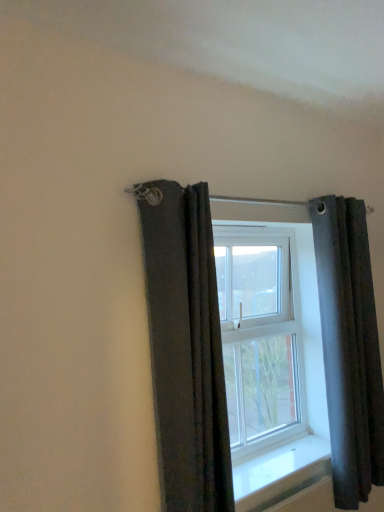
You are a GUI agent. You are given a task and a screenshot of the screen. Output one action in this format:
    pyautogui.click(x=<x>, y=<y>)
    Task: Click on the white glossy window sill at center
    
    Given the screenshot: What is the action you would take?
    pyautogui.click(x=281, y=473)

This screenshot has height=512, width=384. What do you see at coordinates (281, 473) in the screenshot? I see `white glossy window sill at center` at bounding box center [281, 473].

Where is `dark gray fabric curtain at right, positioned as the second curtain in front-to-back order`? Image resolution: width=384 pixels, height=512 pixels. dark gray fabric curtain at right, positioned as the second curtain in front-to-back order is located at coordinates (349, 347).

The height and width of the screenshot is (512, 384). What do you see at coordinates (186, 347) in the screenshot?
I see `dark gray fabric curtain at upper left, the 1th curtain when ordered from left to right` at bounding box center [186, 347].

Locate an element on the screen. white glossy window sill at center is located at coordinates pos(281,473).

In order to click on window sill beneath the dark gray fabric curtain at upper left, acting as the first curtain starting from the front (from a real-world perspective) in this screenshot , I will do `click(281, 473)`.

Which is further, (305, 485) or (140, 185)?

Point (305, 485)

How much distance is there between white glossy window sill at center and dark gray fabric curtain at upper left, the 2th curtain positioned from the back?

white glossy window sill at center is 23.66 inches from dark gray fabric curtain at upper left, the 2th curtain positioned from the back.

From the picture: Is dark gray fabric curtain at upper left, the 1th curtain when ordered from left to right, completely or partially inside white glossy window sill at center?

No, dark gray fabric curtain at upper left, the 1th curtain when ordered from left to right, is not a part of white glossy window sill at center.

Is dark gray fabric curtain at right, the 1th curtain positioned from the right, far away from clear glass window at center?

No.

From the image's perspective, between dark gray fabric curtain at right, the 1th curtain positioned from the right, and clear glass window at center, which one is located above?

clear glass window at center appears higher in the image.

Consider the image. Does dark gray fabric curtain at right, positioned as the second curtain in front-to-back order, have a smaller size compared to clear glass window at center?

No, dark gray fabric curtain at right, positioned as the second curtain in front-to-back order, is not smaller than clear glass window at center.

Identify the location of window sill lying below the dark gray fabric curtain at upper left, arranged as the second curtain when viewed from the right (from the image's perspective). This screenshot has height=512, width=384. (281, 473).

Considering the sizes of objects dark gray fabric curtain at upper left, arranged as the second curtain when viewed from the right, and white glossy window sill at center in the image provided, who is bigger, dark gray fabric curtain at upper left, arranged as the second curtain when viewed from the right, or white glossy window sill at center?

Bigger between the two is dark gray fabric curtain at upper left, arranged as the second curtain when viewed from the right.

Is dark gray fabric curtain at upper left, the 2th curtain positioned from the back, further to camera compared to white glossy window sill at center?

No, it is in front of white glossy window sill at center.

How many degrees apart are the facing directions of dark gray fabric curtain at upper left, the 2th curtain positioned from the back, and white glossy window sill at center?

The angle between the facing direction of dark gray fabric curtain at upper left, the 2th curtain positioned from the back, and the facing direction of white glossy window sill at center is 0.00121 degrees.

Is white glossy window sill at center looking in the opposite direction of dark gray fabric curtain at right, marked as the first curtain in a back-to-front arrangement?

No.

From the image's perspective, which object appears higher, white glossy window sill at center or dark gray fabric curtain at right, which is the 2th curtain in left-to-right order?

dark gray fabric curtain at right, which is the 2th curtain in left-to-right order, is shown above in the image.

From a real-world perspective, is white glossy window sill at center positioned under dark gray fabric curtain at right, the 1th curtain positioned from the right, based on gravity?

Yes, from a real-world perspective, white glossy window sill at center is below dark gray fabric curtain at right, the 1th curtain positioned from the right.

Is white glossy window sill at center to the left or to the right of dark gray fabric curtain at right, the 1th curtain positioned from the right, in the image?

Based on their positions, white glossy window sill at center is located to the left of dark gray fabric curtain at right, the 1th curtain positioned from the right.

Which of these two, clear glass window at center or white glossy window sill at center, is smaller?

white glossy window sill at center.

From a real-world perspective, is clear glass window at center over white glossy window sill at center?

Correct, in the physical world, clear glass window at center is higher than white glossy window sill at center.

Based on the photo, considering the sizes of objects clear glass window at center and white glossy window sill at center in the image provided, who is shorter, clear glass window at center or white glossy window sill at center?

Standing shorter between the two is white glossy window sill at center.

Could you tell me if dark gray fabric curtain at upper left, arranged as the second curtain when viewed from the right, is turned towards dark gray fabric curtain at right, which is the 2th curtain in left-to-right order?

No, dark gray fabric curtain at upper left, arranged as the second curtain when viewed from the right, does not turn towards dark gray fabric curtain at right, which is the 2th curtain in left-to-right order.

Is dark gray fabric curtain at upper left, acting as the first curtain starting from the front, thinner than dark gray fabric curtain at right, the 1th curtain positioned from the right?

In fact, dark gray fabric curtain at upper left, acting as the first curtain starting from the front, might be wider than dark gray fabric curtain at right, the 1th curtain positioned from the right.

Is point (143, 230) closer to viewer compared to point (382, 410)?

Yes.

From the image's perspective, which one is positioned lower, dark gray fabric curtain at upper left, arranged as the second curtain when viewed from the right, or dark gray fabric curtain at right, marked as the first curtain in a back-to-front arrangement?

dark gray fabric curtain at right, marked as the first curtain in a back-to-front arrangement, appears lower in the image.

Between dark gray fabric curtain at right, marked as the first curtain in a back-to-front arrangement, and dark gray fabric curtain at upper left, the 2th curtain positioned from the back, which one appears on the left side from the viewer's perspective?

dark gray fabric curtain at upper left, the 2th curtain positioned from the back.

From a real-world perspective, is dark gray fabric curtain at right, positioned as the second curtain in front-to-back order, on top of dark gray fabric curtain at upper left, the 1th curtain when ordered from left to right?

Incorrect, from a real-world perspective, dark gray fabric curtain at right, positioned as the second curtain in front-to-back order, is lower than dark gray fabric curtain at upper left, the 1th curtain when ordered from left to right.

From the picture: In terms of size, does dark gray fabric curtain at right, which is the 2th curtain in left-to-right order, appear bigger or smaller than dark gray fabric curtain at upper left, the 1th curtain when ordered from left to right?

In the image, dark gray fabric curtain at right, which is the 2th curtain in left-to-right order, appears to be larger than dark gray fabric curtain at upper left, the 1th curtain when ordered from left to right.

Can you confirm if dark gray fabric curtain at right, marked as the first curtain in a back-to-front arrangement, is shorter than dark gray fabric curtain at upper left, the 1th curtain when ordered from left to right?

No.

From the image's perspective, starting from the white glossy window sill at center, which curtain is the 2nd one above? Please provide its 2D coordinates.

[(186, 347)]

You are a GUI agent. You are given a task and a screenshot of the screen. Output one action in this format:
    pyautogui.click(x=<x>, y=<y>)
    Task: Click on the window behind the dark gray fabric curtain at right, positioned as the second curtain in front-to-back order
    This screenshot has width=384, height=512.
    Given the screenshot: What is the action you would take?
    point(291,358)

Which object lies nearer to the anchor point dark gray fabric curtain at upper left, the 1th curtain when ordered from left to right, white glossy window sill at center or clear glass window at center?

clear glass window at center lies closer to dark gray fabric curtain at upper left, the 1th curtain when ordered from left to right, than the other object.

From the image, which object appears to be farther from dark gray fabric curtain at right, positioned as the second curtain in front-to-back order, dark gray fabric curtain at upper left, the 1th curtain when ordered from left to right, or clear glass window at center?

dark gray fabric curtain at upper left, the 1th curtain when ordered from left to right, is positioned further to the anchor dark gray fabric curtain at right, positioned as the second curtain in front-to-back order.

Which object lies further to the anchor point dark gray fabric curtain at upper left, acting as the first curtain starting from the front, dark gray fabric curtain at right, positioned as the second curtain in front-to-back order, or clear glass window at center?

dark gray fabric curtain at right, positioned as the second curtain in front-to-back order, is positioned further to the anchor dark gray fabric curtain at upper left, acting as the first curtain starting from the front.

Which object lies nearer to the anchor point dark gray fabric curtain at upper left, acting as the first curtain starting from the front, dark gray fabric curtain at right, the 1th curtain positioned from the right, or white glossy window sill at center?

Based on the image, white glossy window sill at center appears to be nearer to dark gray fabric curtain at upper left, acting as the first curtain starting from the front.

When comparing their distances from dark gray fabric curtain at upper left, the 1th curtain when ordered from left to right, does white glossy window sill at center or dark gray fabric curtain at right, marked as the first curtain in a back-to-front arrangement, seem closer?

white glossy window sill at center is closer to dark gray fabric curtain at upper left, the 1th curtain when ordered from left to right.

From the image, which object appears to be farther from white glossy window sill at center, dark gray fabric curtain at right, marked as the first curtain in a back-to-front arrangement, or dark gray fabric curtain at upper left, the 2th curtain positioned from the back?

The object further to white glossy window sill at center is dark gray fabric curtain at upper left, the 2th curtain positioned from the back.

Looking at the image, which one is located further to dark gray fabric curtain at right, marked as the first curtain in a back-to-front arrangement, white glossy window sill at center or clear glass window at center?

white glossy window sill at center is positioned further to the anchor dark gray fabric curtain at right, marked as the first curtain in a back-to-front arrangement.

Estimate the real-world distances between objects in this image. Which object is further from clear glass window at center, dark gray fabric curtain at upper left, arranged as the second curtain when viewed from the right, or white glossy window sill at center?

Based on the image, dark gray fabric curtain at upper left, arranged as the second curtain when viewed from the right, appears to be further to clear glass window at center.

You are a GUI agent. You are given a task and a screenshot of the screen. Output one action in this format:
    pyautogui.click(x=<x>, y=<y>)
    Task: Click on the window located between dark gray fabric curtain at upper left, the 1th curtain when ordered from left to right, and dark gray fabric curtain at right, the 1th curtain positioned from the right, in the left-right direction
    The image size is (384, 512).
    Given the screenshot: What is the action you would take?
    pyautogui.click(x=291, y=358)

You are a GUI agent. You are given a task and a screenshot of the screen. Output one action in this format:
    pyautogui.click(x=<x>, y=<y>)
    Task: Click on the curtain between clear glass window at center and white glossy window sill at center in the vertical direction
    
    Given the screenshot: What is the action you would take?
    pyautogui.click(x=349, y=347)

Find the location of a particular element. window that lies between dark gray fabric curtain at upper left, the 1th curtain when ordered from left to right, and white glossy window sill at center from top to bottom is located at coordinates (291, 358).

At what (x,y) coordinates should I click in order to perform the action: click on window sill between dark gray fabric curtain at upper left, the 2th curtain positioned from the back, and dark gray fabric curtain at right, positioned as the second curtain in front-to-back order. Please return your answer as a coordinate pair (x, y). The height and width of the screenshot is (512, 384). Looking at the image, I should click on (281, 473).